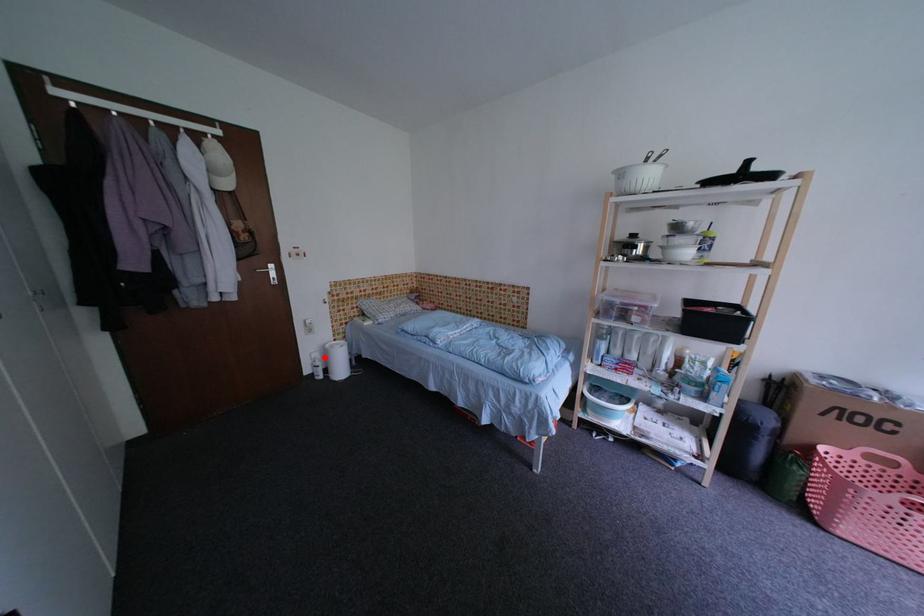
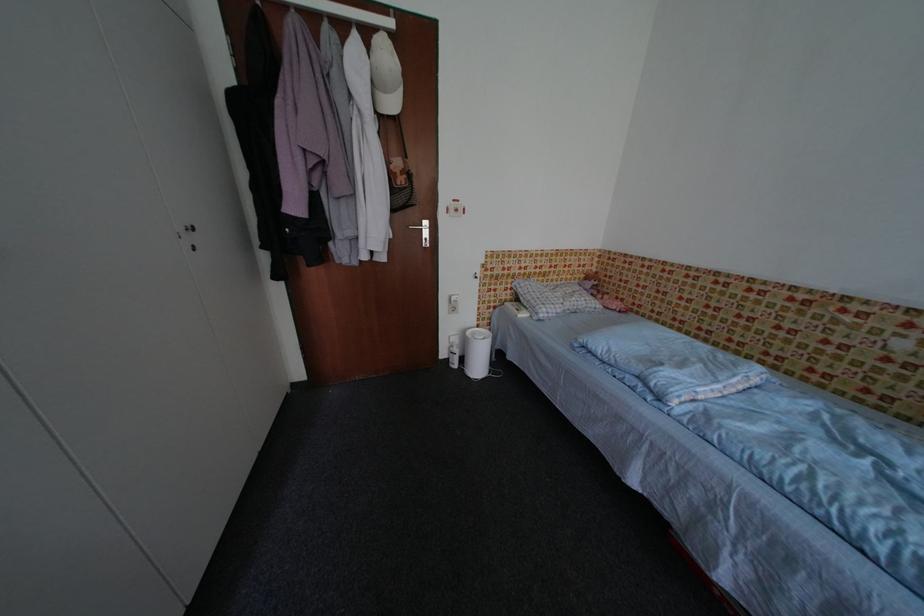
Where in the second image is the point corresponding to the highlighted location from the first image?

(464, 342)